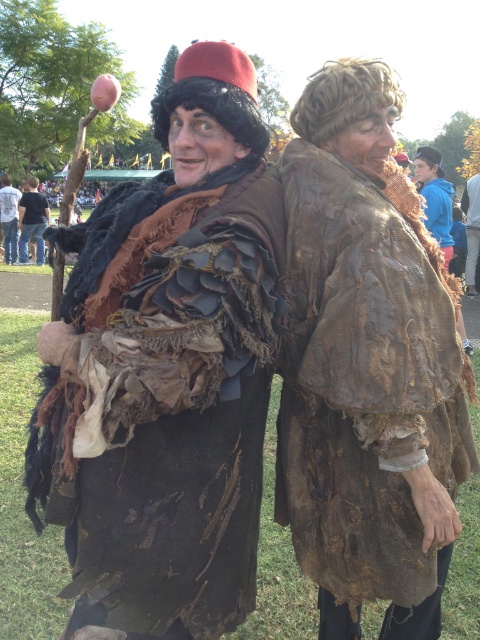
You are an event organizer checking the costumes for a historical reenactment. You need to ensure that the brown textured fabric at center and the rusty fabric coat at center are both visible to the audience. Given their sizes, which one might require a more elevated display to ensure visibility?

The brown textured fabric at center is smaller than the rusty fabric coat at center, so the brown textured fabric at center might require a more elevated display to ensure visibility.

You are a costume designer observing the scene. You need to place a blue fleece jacket at right onto a mannequin. Based on the coordinates provided in the Objects Description, where should you position the jacket relative to the other elements in the scene?

The blue fleece jacket at right should be positioned at coordinates point (434, 198) as specified in the Objects Description.

You are an observer at a costume event. You see the brown textured fabric at center and the blue fleece jacket at right. Which one is positioned lower in the image?

The brown textured fabric at center is located below the blue fleece jacket at right, so it is positioned lower in the image.